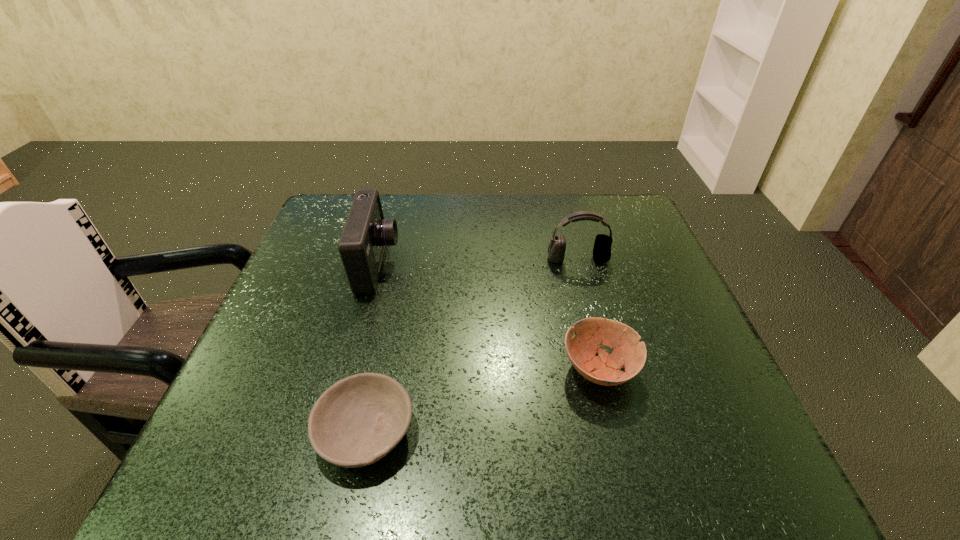
The width and height of the screenshot is (960, 540). In order to click on object located in the far edge section of the desktop in this screenshot , I will do `click(365, 234)`.

At what (x,y) coordinates should I click in order to perform the action: click on object positioned at the near edge. Please return your answer as a coordinate pair (x, y). Looking at the image, I should click on (357, 421).

What are the coordinates of `object at the left edge` in the screenshot? It's located at (365, 234).

You are a GUI agent. You are given a task and a screenshot of the screen. Output one action in this format:
    pyautogui.click(x=<x>, y=<y>)
    Task: Click on the headset that is positioned at the right edge
    
    Given the screenshot: What is the action you would take?
    pyautogui.click(x=602, y=246)

The width and height of the screenshot is (960, 540). Identify the location of bowl present at the right edge. (590, 333).

This screenshot has width=960, height=540. I want to click on object that is at the far left corner, so (365, 234).

Locate an element on the screen. The height and width of the screenshot is (540, 960). free space at the far edge of the desktop is located at coordinates (519, 202).

In the image, there is a desktop. Where is `blank space at the right edge`? blank space at the right edge is located at coordinates (690, 392).

Where is `vacant area at the far left corner of the desktop`? vacant area at the far left corner of the desktop is located at coordinates (335, 225).

At what (x,y) coordinates should I click in order to perform the action: click on free spot at the near left corner of the desktop. Please return your answer as a coordinate pair (x, y). The image size is (960, 540). Looking at the image, I should click on (268, 475).